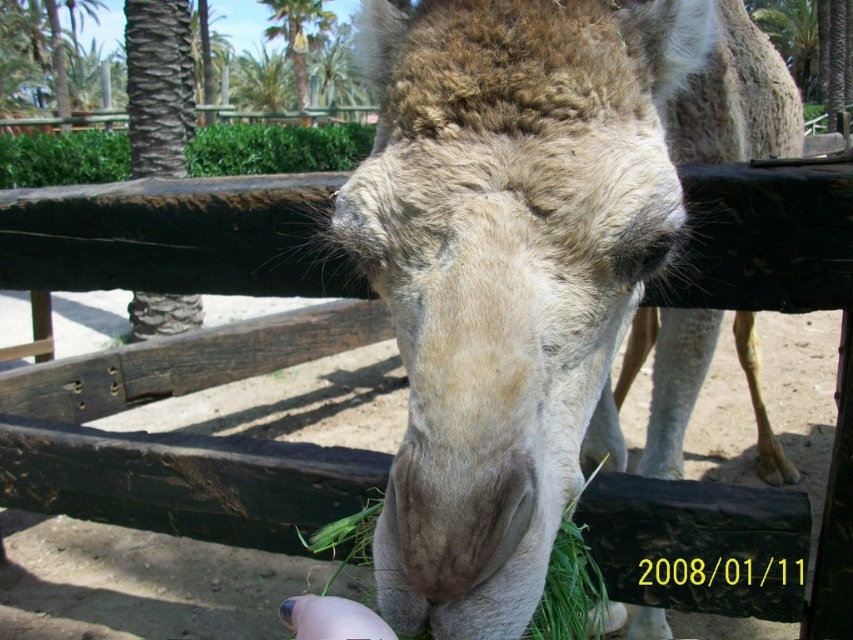
Question: Is fuzzy beige camel at center below green leafy palm tree at upper center?

Choices:
 (A) yes
 (B) no

Answer: (A)

Question: Which point is closer to the camera?

Choices:
 (A) green leafy palm tree at upper center
 (B) fuzzy beige camel at center

Answer: (B)

Question: From the image, what is the correct spatial relationship of fuzzy beige camel at center in relation to green leafy palm tree at upper center?

Choices:
 (A) below
 (B) above

Answer: (A)

Question: Is fuzzy beige camel at center above green leafy palm tree at upper center?

Choices:
 (A) no
 (B) yes

Answer: (A)

Question: Which point is closer to the camera taking this photo?

Choices:
 (A) (439, 100)
 (B) (318, 4)

Answer: (A)